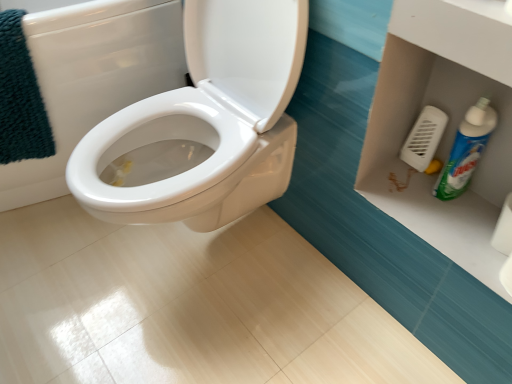
Question: Is teal plush bath towel at upper left turned away from green plastic bottle at lower right?

Choices:
 (A) yes
 (B) no

Answer: (B)

Question: Is green plastic bottle at lower right inside teal plush bath towel at upper left?

Choices:
 (A) no
 (B) yes

Answer: (A)

Question: Is teal plush bath towel at upper left smaller than green plastic bottle at lower right?

Choices:
 (A) yes
 (B) no

Answer: (B)

Question: Is teal plush bath towel at upper left not inside green plastic bottle at lower right?

Choices:
 (A) yes
 (B) no

Answer: (A)

Question: Is teal plush bath towel at upper left further to the viewer compared to green plastic bottle at lower right?

Choices:
 (A) no
 (B) yes

Answer: (B)

Question: From the image's perspective, is teal plush bath towel at upper left below green plastic bottle at lower right?

Choices:
 (A) yes
 (B) no

Answer: (B)

Question: Does white plastic vent at right lie in front of white glossy toilet at center?

Choices:
 (A) no
 (B) yes

Answer: (A)

Question: Does white plastic vent at right turn towards white glossy toilet at center?

Choices:
 (A) yes
 (B) no

Answer: (B)

Question: From the image's perspective, does white plastic vent at right appear lower than white glossy toilet at center?

Choices:
 (A) yes
 (B) no

Answer: (A)

Question: Could white glossy toilet at center be considered to be inside white plastic vent at right?

Choices:
 (A) no
 (B) yes

Answer: (A)

Question: Does white plastic vent at right have a greater height compared to white glossy toilet at center?

Choices:
 (A) yes
 (B) no

Answer: (B)

Question: From the image's perspective, is white plastic vent at right over white glossy toilet at center?

Choices:
 (A) no
 (B) yes

Answer: (A)

Question: Are white plastic vent at right and teal plush bath towel at upper left making contact?

Choices:
 (A) no
 (B) yes

Answer: (A)